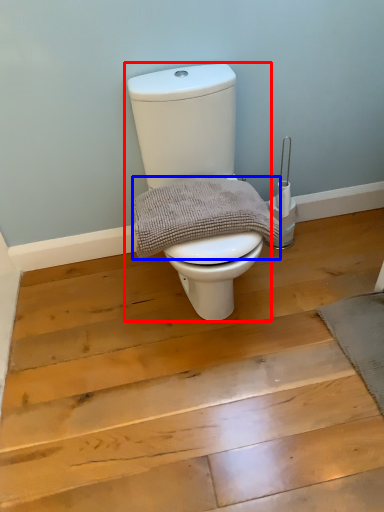
Question: Which object appears farthest to the camera in this image, toilet (highlighted by a red box) or material (highlighted by a blue box)?

Choices:
 (A) toilet
 (B) material

Answer: (B)